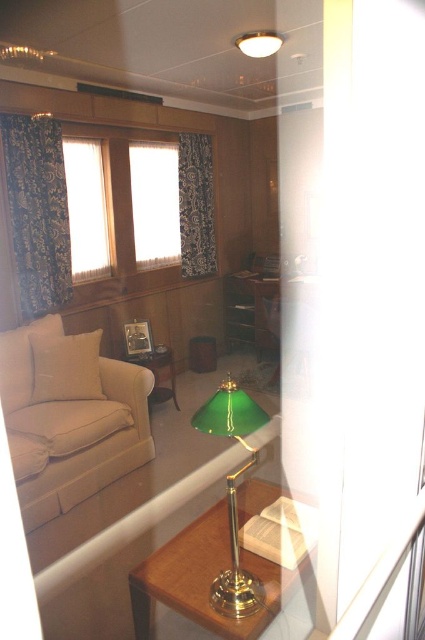
Question: Can you confirm if gold metallic table at lower right is positioned to the right of dark blue textured curtain at left?

Choices:
 (A) no
 (B) yes

Answer: (B)

Question: Among these objects, which one is nearest to the camera?

Choices:
 (A) matte wood side table at lower left
 (B) white lace curtain at upper center
 (C) green glass lampshade at upper center

Answer: (C)

Question: Is green glass lamp at lower center positioned before matte wood side table at lower left?

Choices:
 (A) no
 (B) yes

Answer: (B)

Question: Among these objects, which one is nearest to the camera?

Choices:
 (A) matte wood side table at lower left
 (B) white sheer curtain at upper left

Answer: (B)

Question: Which point is closer to the camera?

Choices:
 (A) (184, 260)
 (B) (164, 580)
 (C) (232, 547)

Answer: (C)

Question: Can you confirm if dark blue textured curtain at left is positioned to the right of white sheer curtain at upper left?

Choices:
 (A) yes
 (B) no

Answer: (B)